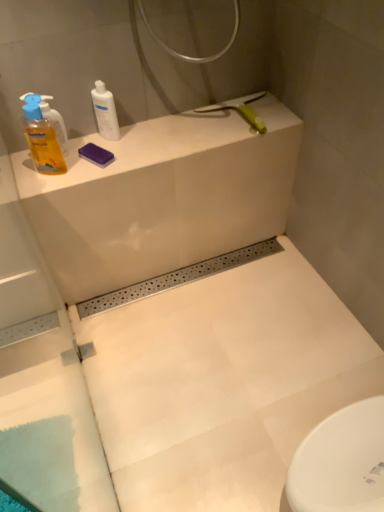
What do you see at coordinates (43, 137) in the screenshot? I see `yellow translucent liquid at left, which is the 1th cleaning product in left-to-right order` at bounding box center [43, 137].

How much space does white glossy bottle at upper left, arranged as the 2th cleaning product when viewed from the left, occupy vertically?

The height of white glossy bottle at upper left, arranged as the 2th cleaning product when viewed from the left, is 6.70 inches.

The width and height of the screenshot is (384, 512). What do you see at coordinates (162, 197) in the screenshot? I see `white matte counter top at upper left` at bounding box center [162, 197].

What are the coordinates of `yellow translucent liquid at left, the 2th cleaning product from the right` in the screenshot? It's located at (43, 137).

Between white glossy bottle at upper left, arranged as the 2th cleaning product when viewed from the left, and yellow translucent liquid at left, the 2th cleaning product from the right, which one appears on the left side from the viewer's perspective?

Positioned to the left is yellow translucent liquid at left, the 2th cleaning product from the right.

Locate an element on the screen. cleaning product located below the white glossy bottle at upper left, which is counted as the 1th cleaning product, starting from the right (from the image's perspective) is located at coordinates (43, 137).

Considering the relative positions of white glossy bottle at upper left, arranged as the 2th cleaning product when viewed from the left, and yellow translucent liquid at left, the 2th cleaning product from the right, in the image provided, is white glossy bottle at upper left, arranged as the 2th cleaning product when viewed from the left, behind yellow translucent liquid at left, the 2th cleaning product from the right,?

Yes, it is.

Does white glossy bottle at upper left, arranged as the 2th cleaning product when viewed from the left, touch yellow translucent liquid at left, the 2th cleaning product from the right?

No, white glossy bottle at upper left, arranged as the 2th cleaning product when viewed from the left, is not next to yellow translucent liquid at left, the 2th cleaning product from the right.

Considering their positions, is yellow translucent liquid at left, the 2th cleaning product from the right, located in front of or behind white glossy bottle at upper left, arranged as the 2th cleaning product when viewed from the left?

In the image, yellow translucent liquid at left, the 2th cleaning product from the right, appears in front of white glossy bottle at upper left, arranged as the 2th cleaning product when viewed from the left.

Can white glossy bottle at upper left, which is counted as the 1th cleaning product, starting from the right, be found inside yellow translucent liquid at left, the 2th cleaning product from the right?

No, white glossy bottle at upper left, which is counted as the 1th cleaning product, starting from the right, is located outside of yellow translucent liquid at left, the 2th cleaning product from the right.

How different are the orientations of yellow translucent liquid at left, which is the 1th cleaning product in left-to-right order, and white glossy bottle at upper left, which is counted as the 1th cleaning product, starting from the right, in degrees?

31.2 degrees separate the facing orientations of yellow translucent liquid at left, which is the 1th cleaning product in left-to-right order, and white glossy bottle at upper left, which is counted as the 1th cleaning product, starting from the right.

How much distance is there between white matte counter top at upper left and white glossy bottle at upper left, which is counted as the 1th cleaning product, starting from the right?

They are 12.64 inches apart.

Considering the relative sizes of white matte counter top at upper left and white glossy bottle at upper left, arranged as the 2th cleaning product when viewed from the left, in the image provided, is white matte counter top at upper left taller than white glossy bottle at upper left, arranged as the 2th cleaning product when viewed from the left,?

Incorrect, the height of white matte counter top at upper left is not larger of that of white glossy bottle at upper left, arranged as the 2th cleaning product when viewed from the left.

Considering the sizes of objects white matte counter top at upper left and white glossy bottle at upper left, arranged as the 2th cleaning product when viewed from the left, in the image provided, who is wider, white matte counter top at upper left or white glossy bottle at upper left, arranged as the 2th cleaning product when viewed from the left,?

Wider between the two is white matte counter top at upper left.

Can you confirm if white matte counter top at upper left is positioned to the left of white glossy bottle at upper left, which is counted as the 1th cleaning product, starting from the right?

Incorrect, white matte counter top at upper left is not on the left side of white glossy bottle at upper left, which is counted as the 1th cleaning product, starting from the right.

Is yellow translucent liquid at left, which is the 1th cleaning product in left-to-right order, wider or thinner than white matte counter top at upper left?

Clearly, yellow translucent liquid at left, which is the 1th cleaning product in left-to-right order, has less width compared to white matte counter top at upper left.

Could you measure the distance between yellow translucent liquid at left, which is the 1th cleaning product in left-to-right order, and white matte counter top at upper left?

The distance of yellow translucent liquid at left, which is the 1th cleaning product in left-to-right order, from white matte counter top at upper left is 13.33 inches.

Considering the positions of objects yellow translucent liquid at left, the 2th cleaning product from the right, and white matte counter top at upper left in the image provided, who is behind, yellow translucent liquid at left, the 2th cleaning product from the right, or white matte counter top at upper left?

white matte counter top at upper left is behind.

From a real-world perspective, which is physically above, yellow translucent liquid at left, the 2th cleaning product from the right, or white matte counter top at upper left?

yellow translucent liquid at left, the 2th cleaning product from the right.

Could you measure the distance between white matte counter top at upper left and yellow translucent liquid at left, which is the 1th cleaning product in left-to-right order?

white matte counter top at upper left and yellow translucent liquid at left, which is the 1th cleaning product in left-to-right order, are 13.33 inches apart from each other.

Looking at this image, could you tell me if white matte counter top at upper left is facing yellow translucent liquid at left, the 2th cleaning product from the right?

No, white matte counter top at upper left is not aimed at yellow translucent liquid at left, the 2th cleaning product from the right.

Is white matte counter top at upper left directly adjacent to yellow translucent liquid at left, which is the 1th cleaning product in left-to-right order?

There is a gap between white matte counter top at upper left and yellow translucent liquid at left, which is the 1th cleaning product in left-to-right order.

Looking at this image, is white matte counter top at upper left smaller than yellow translucent liquid at left, which is the 1th cleaning product in left-to-right order?

Incorrect, white matte counter top at upper left is not smaller in size than yellow translucent liquid at left, which is the 1th cleaning product in left-to-right order.

Does white glossy bottle at upper left, which is counted as the 1th cleaning product, starting from the right, come in front of white matte counter top at upper left?

No, it is behind white matte counter top at upper left.

Between white glossy bottle at upper left, arranged as the 2th cleaning product when viewed from the left, and white matte counter top at upper left, which one has larger size?

With larger size is white matte counter top at upper left.

From the image's perspective, is white glossy bottle at upper left, which is counted as the 1th cleaning product, starting from the right, below white matte counter top at upper left?

No, from the image's perspective, white glossy bottle at upper left, which is counted as the 1th cleaning product, starting from the right, is not below white matte counter top at upper left.

In order to click on cleaning product located in front of the white glossy bottle at upper left, which is counted as the 1th cleaning product, starting from the right in this screenshot , I will do `click(43, 137)`.

At what (x,y) coordinates should I click in order to perform the action: click on cleaning product above the yellow translucent liquid at left, which is the 1th cleaning product in left-to-right order (from the image's perspective). Please return your answer as a coordinate pair (x, y). Looking at the image, I should click on (105, 112).

Considering their positions, is white matte counter top at upper left positioned further to yellow translucent liquid at left, the 2th cleaning product from the right, than white glossy bottle at upper left, arranged as the 2th cleaning product when viewed from the left?

The object further to yellow translucent liquid at left, the 2th cleaning product from the right, is white matte counter top at upper left.

Looking at the image, which one is located closer to white matte counter top at upper left, yellow translucent liquid at left, which is the 1th cleaning product in left-to-right order, or white glossy bottle at upper left, arranged as the 2th cleaning product when viewed from the left?

white glossy bottle at upper left, arranged as the 2th cleaning product when viewed from the left, is closer to white matte counter top at upper left.

Considering their positions, is yellow translucent liquid at left, which is the 1th cleaning product in left-to-right order, positioned further to white glossy bottle at upper left, arranged as the 2th cleaning product when viewed from the left, than white matte counter top at upper left?

white matte counter top at upper left is further to white glossy bottle at upper left, arranged as the 2th cleaning product when viewed from the left.

Considering their positions, is white glossy bottle at upper left, which is counted as the 1th cleaning product, starting from the right, positioned further to yellow translucent liquid at left, which is the 1th cleaning product in left-to-right order, than white matte counter top at upper left?

Based on the image, white matte counter top at upper left appears to be further to yellow translucent liquid at left, which is the 1th cleaning product in left-to-right order.

Estimate the real-world distances between objects in this image. Which object is further from white matte counter top at upper left, white glossy bottle at upper left, arranged as the 2th cleaning product when viewed from the left, or yellow translucent liquid at left, which is the 1th cleaning product in left-to-right order?

yellow translucent liquid at left, which is the 1th cleaning product in left-to-right order, is positioned further to the anchor white matte counter top at upper left.

Looking at this image, considering their positions, is white matte counter top at upper left positioned further to white glossy bottle at upper left, which is counted as the 1th cleaning product, starting from the right, than yellow translucent liquid at left, which is the 1th cleaning product in left-to-right order?

The object further to white glossy bottle at upper left, which is counted as the 1th cleaning product, starting from the right, is white matte counter top at upper left.

Where is `cleaning product between yellow translucent liquid at left, the 2th cleaning product from the right, and white matte counter top at upper left`? The width and height of the screenshot is (384, 512). cleaning product between yellow translucent liquid at left, the 2th cleaning product from the right, and white matte counter top at upper left is located at coordinates (105, 112).